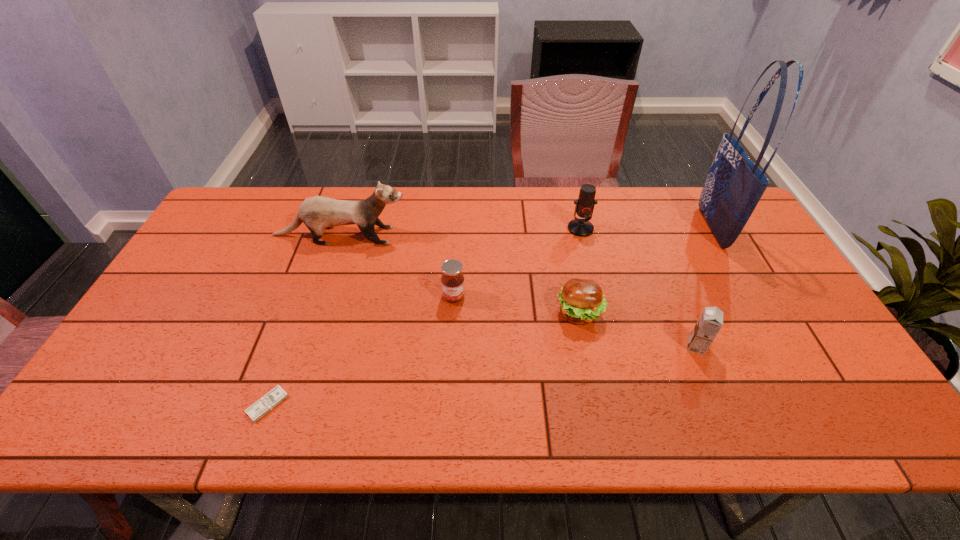
Identify the location of vacant area located 0.230m on the front-facing side of the tallest object. The width and height of the screenshot is (960, 540). (633, 228).

Locate an element on the screen. The height and width of the screenshot is (540, 960). free location located on the front-facing side of the tallest object is located at coordinates (648, 228).

Locate an element on the screen. This screenshot has width=960, height=540. free location located 0.370m on the front-facing side of the tallest object is located at coordinates (589, 228).

Image resolution: width=960 pixels, height=540 pixels. I want to click on vacant space located 0.210m on the face of the ferret, so click(474, 235).

Identify the location of vacant space located on the side of the microphone with the red ring. The image size is (960, 540). (592, 275).

Image resolution: width=960 pixels, height=540 pixels. I want to click on vacant area situated on the left of the sixth object from left to right, so click(x=565, y=347).

Where is `free space located on the label side of the jam`? free space located on the label side of the jam is located at coordinates (449, 376).

Image resolution: width=960 pixels, height=540 pixels. I want to click on vacant space positioned on the right of the sixth tallest object, so click(667, 313).

The width and height of the screenshot is (960, 540). I want to click on free space located on the right of the money, so click(379, 404).

At what (x,y) coordinates should I click in order to perform the action: click on shopping bag that is at the far edge. Please return your answer as a coordinate pair (x, y). The image size is (960, 540). Looking at the image, I should click on (734, 186).